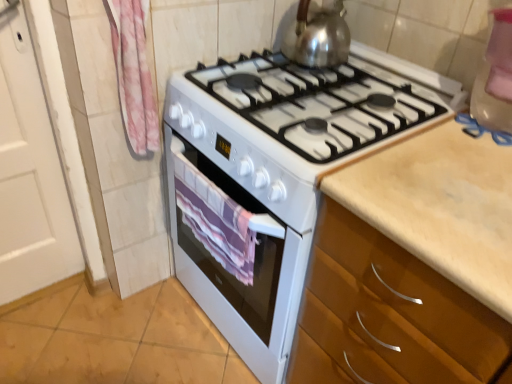
Question: Is white glossy stove at center taller or shorter than pink fabric towel at left?

Choices:
 (A) short
 (B) tall

Answer: (B)

Question: Is white glossy stove at center wider or thinner than pink fabric towel at left?

Choices:
 (A) thin
 (B) wide

Answer: (B)

Question: Which object is positioned farthest from the purple striped towel at center?

Choices:
 (A) shiny metallic kettle at upper center
 (B) white glossy stove at center
 (C) pink fabric towel at left

Answer: (A)

Question: Estimate the real-world distances between objects in this image. Which object is farther from the shiny metallic kettle at upper center?

Choices:
 (A) purple striped towel at center
 (B) white glossy stove at center
 (C) pink fabric towel at left

Answer: (A)